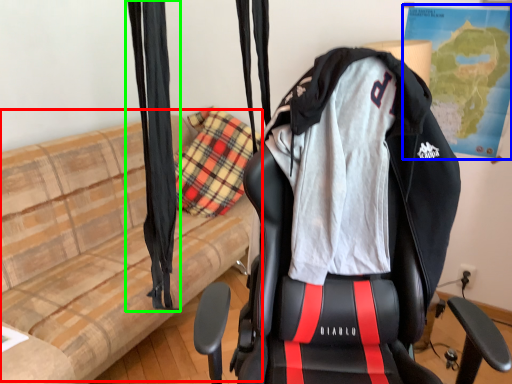
Question: Considering the real-world distances, which object is farthest from couch (highlighted by a red box)? map (highlighted by a blue box) or curtain (highlighted by a green box)?

Choices:
 (A) map
 (B) curtain

Answer: (A)